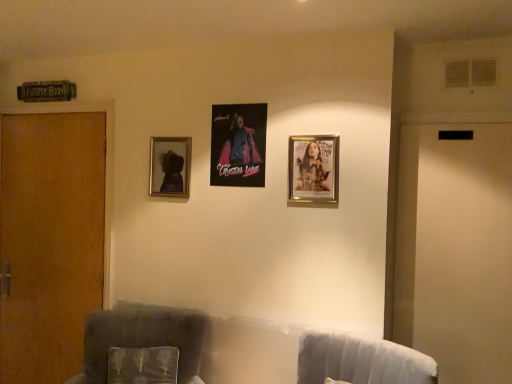
What is the approximate width of velvet dark gray armchair at left?

35.10 inches.

Measure the distance between point [352,371] and camera.

They are 6.48 feet apart.

Image resolution: width=512 pixels, height=384 pixels. Find the location of `matte black portrait at upper left, arranged as the 3th picture frame when viewed from the front`. matte black portrait at upper left, arranged as the 3th picture frame when viewed from the front is located at coordinates (170, 166).

Identify the location of velvet dark gray armchair at left. The height and width of the screenshot is (384, 512). (147, 338).

Consider the image. Can you confirm if velvet dark gray armchair at left is taller than metallic poster at center, which is counted as the second picture frame, starting from the left?

Correct, velvet dark gray armchair at left is much taller as metallic poster at center, which is counted as the second picture frame, starting from the left.

From the image's perspective, does velvet dark gray armchair at left appear higher than metallic poster at center, acting as the 2th picture frame starting from the right?

No, from the image's perspective, velvet dark gray armchair at left is not above metallic poster at center, acting as the 2th picture frame starting from the right.

From a real-world perspective, is velvet dark gray armchair at left below metallic poster at center, acting as the 2th picture frame starting from the right?

Correct, in the physical world, velvet dark gray armchair at left is lower than metallic poster at center, acting as the 2th picture frame starting from the right.

Is the surface of velvet gray swivel chair at lower right in direct contact with matte black portrait at upper left, which is counted as the 1th picture frame, starting from the back?

There is a gap between velvet gray swivel chair at lower right and matte black portrait at upper left, which is counted as the 1th picture frame, starting from the back.

Is matte black portrait at upper left, positioned as the 3th picture frame in right-to-left order, a part of velvet gray swivel chair at lower right?

That's incorrect, matte black portrait at upper left, positioned as the 3th picture frame in right-to-left order, is not inside velvet gray swivel chair at lower right.

Does velvet gray swivel chair at lower right turn towards matte black portrait at upper left, arranged as the 3th picture frame when viewed from the front?

No, velvet gray swivel chair at lower right does not turn towards matte black portrait at upper left, arranged as the 3th picture frame when viewed from the front.

Can you tell me how much velvet gray swivel chair at lower right and matte black portrait at upper left, which is the 1th picture frame in left-to-right order, differ in facing direction?

The facing directions of velvet gray swivel chair at lower right and matte black portrait at upper left, which is the 1th picture frame in left-to-right order, are 18.8 degrees apart.

Is matte black portrait at upper left, which is counted as the 1th picture frame, starting from the back, positioned with its back to metallic poster at center, which is counted as the second picture frame, starting from the left?

No, matte black portrait at upper left, which is counted as the 1th picture frame, starting from the back,'s orientation is not away from metallic poster at center, which is counted as the second picture frame, starting from the left.

Between matte black portrait at upper left, arranged as the 3th picture frame when viewed from the front, and metallic poster at center, which is counted as the second picture frame, starting from the left, which one has smaller size?

metallic poster at center, which is counted as the second picture frame, starting from the left.

The height and width of the screenshot is (384, 512). I want to click on picture frame that appears behind the metallic poster at center, which is the 2th picture frame in back-to-front order, so click(170, 166).

Find the location of `furniture in front of the brown wood door at left`. furniture in front of the brown wood door at left is located at coordinates (147, 338).

From a real-world perspective, which object stands above the other?

brown wood door at left, from a real-world perspective.

Is velvet dark gray armchair at left a part of brown wood door at left?

No, velvet dark gray armchair at left is not surrounded by brown wood door at left.

In the scene shown: How different are the orientations of brown wood door at left and velvet dark gray armchair at left in degrees?

20.8 degrees.

From a real-world perspective, starting from the velvet gray swivel chair at lower right, which picture frame is the 3rd one vertically above it? Please provide its 2D coordinates.

[(238, 145)]

How different are the orientations of metallic poster at center, which is the 2th picture frame in back-to-front order, and velvet gray swivel chair at lower right in degrees?

18.8 degrees separate the facing orientations of metallic poster at center, which is the 2th picture frame in back-to-front order, and velvet gray swivel chair at lower right.

Which is more distant, (218, 156) or (300, 342)?

Positioned behind is point (218, 156).

Between metallic poster at center, acting as the 2th picture frame starting from the right, and velvet gray swivel chair at lower right, which one has larger size?

velvet gray swivel chair at lower right.

In the scene shown: Is velvety green pillow at lower left at the right side of velvet dark gray armchair at left?

Yes, velvety green pillow at lower left is to the right of velvet dark gray armchair at left.

Which object is wider, velvety green pillow at lower left or velvet dark gray armchair at left?

With larger width is velvet dark gray armchair at left.

From a real-world perspective, relative to velvet dark gray armchair at left, is velvety green pillow at lower left vertically above or below?

In terms of real-world spatial position, velvety green pillow at lower left is below velvet dark gray armchair at left.

From the image's perspective, is velvety green pillow at lower left above velvet dark gray armchair at left?

No, from the image's perspective, velvety green pillow at lower left is not over velvet dark gray armchair at left.

How different are the orientations of gold metallic picture frame at upper right, which is the third picture frame from back to front, and velvet dark gray armchair at left in degrees?

20.8 degrees separate the facing orientations of gold metallic picture frame at upper right, which is the third picture frame from back to front, and velvet dark gray armchair at left.

From a real-world perspective, between gold metallic picture frame at upper right, which is the first picture frame from right to left, and velvet dark gray armchair at left, who is vertically lower?

velvet dark gray armchair at left is physically lower.

From the image's perspective, is gold metallic picture frame at upper right, which is the first picture frame from right to left, over velvet dark gray armchair at left?

Yes.

Which object is more forward, gold metallic picture frame at upper right, which is counted as the 3th picture frame, starting from the left, or velvet dark gray armchair at left?

velvet dark gray armchair at left is more forward.

Locate an element on the screen. The height and width of the screenshot is (384, 512). picture frame that is the 3rd object above the velvet dark gray armchair at left (from a real-world perspective) is located at coordinates (238, 145).

Where is `the 3rd picture frame to the left of the velvet gray swivel chair at lower right, counting from the anchor's position`? The image size is (512, 384). the 3rd picture frame to the left of the velvet gray swivel chair at lower right, counting from the anchor's position is located at coordinates (170, 166).

Estimate the real-world distances between objects in this image. Which object is closer to velvety green pillow at lower left, matte black portrait at upper left, arranged as the 3th picture frame when viewed from the front, or velvet dark gray armchair at left?

velvet dark gray armchair at left is positioned closer to the anchor velvety green pillow at lower left.

Looking at this image, based on their spatial positions, is velvet gray swivel chair at lower right or matte black portrait at upper left, positioned as the 3th picture frame in right-to-left order, closer to metallic poster at center, the 2th picture frame positioned from the front?

matte black portrait at upper left, positioned as the 3th picture frame in right-to-left order, is closer to metallic poster at center, the 2th picture frame positioned from the front.

Estimate the real-world distances between objects in this image. Which object is closer to matte black portrait at upper left, which is the 1th picture frame in left-to-right order, gold metallic picture frame at upper right, which is the first picture frame from right to left, or metallic poster at center, acting as the 2th picture frame starting from the right?

metallic poster at center, acting as the 2th picture frame starting from the right.

Considering their positions, is matte black portrait at upper left, arranged as the 3th picture frame when viewed from the front, positioned further to gold metallic picture frame at upper right, which is the first picture frame from right to left, than velvet dark gray armchair at left?

The object further to gold metallic picture frame at upper right, which is the first picture frame from right to left, is velvet dark gray armchair at left.

From the image, which object appears to be farther from metallic poster at center, which is counted as the second picture frame, starting from the left, matte black portrait at upper left, which is the 1th picture frame in left-to-right order, or gold metallic picture frame at upper right, which is the third picture frame from back to front?

gold metallic picture frame at upper right, which is the third picture frame from back to front, is positioned further to the anchor metallic poster at center, which is counted as the second picture frame, starting from the left.

Estimate the real-world distances between objects in this image. Which object is closer to velvet gray swivel chair at lower right, gold metallic picture frame at upper right, which is the third picture frame from back to front, or metallic poster at center, which is the 2th picture frame in back-to-front order?

gold metallic picture frame at upper right, which is the third picture frame from back to front.

Based on their spatial positions, is metallic poster at center, which is the 2th picture frame in back-to-front order, or brown wood door at left further from gold metallic picture frame at upper right, which is the third picture frame from back to front?

Based on the image, brown wood door at left appears to be further to gold metallic picture frame at upper right, which is the third picture frame from back to front.

Looking at the image, which one is located further to gold metallic picture frame at upper right, which is the third picture frame from back to front, velvety green pillow at lower left or velvet dark gray armchair at left?

velvety green pillow at lower left lies further to gold metallic picture frame at upper right, which is the third picture frame from back to front, than the other object.

You are a GUI agent. You are given a task and a screenshot of the screen. Output one action in this format:
    pyautogui.click(x=<x>, y=<y>)
    Task: Click on the furniture between metallic poster at center, which is the 2th picture frame in back-to-front order, and velvety green pillow at lower left from top to bottom
    
    Given the screenshot: What is the action you would take?
    pyautogui.click(x=147, y=338)

The image size is (512, 384). Find the location of `pillow between brown wood door at left and velvet gray swivel chair at lower right from left to right`. pillow between brown wood door at left and velvet gray swivel chair at lower right from left to right is located at coordinates (143, 365).

I want to click on swivel chair between gold metallic picture frame at upper right, which appears as the 1th picture frame when viewed from the front, and velvet dark gray armchair at left vertically, so click(360, 360).

Locate an element on the screen. This screenshot has width=512, height=384. pillow between brown wood door at left and metallic poster at center, which is the 2th picture frame in back-to-front order is located at coordinates (143, 365).